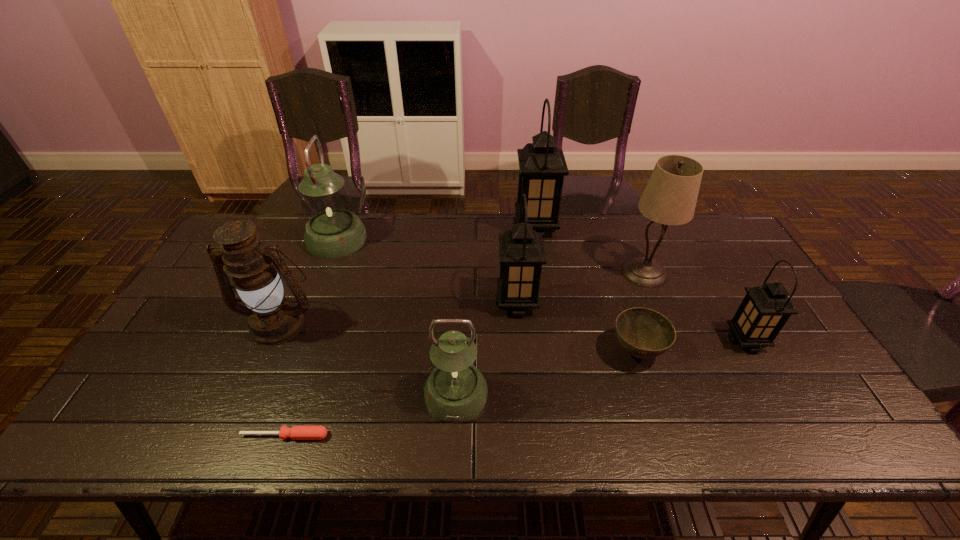
The height and width of the screenshot is (540, 960). Identify the location of blank space located 0.180m on the front of the left greenish lantern. (314, 299).

Where is `vacant space situated on the right of the second farthest black lantern`? vacant space situated on the right of the second farthest black lantern is located at coordinates (587, 303).

You are a GUI agent. You are given a task and a screenshot of the screen. Output one action in this format:
    pyautogui.click(x=<x>, y=<y>)
    Task: Click on the vacant space situated 0.320m on the back of the oil lamp
    This screenshot has width=960, height=540.
    Given the screenshot: What is the action you would take?
    pyautogui.click(x=317, y=235)

Find the location of a particular element. The image size is (960, 540). free space located 0.080m on the right of the nearest black lantern is located at coordinates (793, 341).

Identify the location of vacant space located on the right of the fourth lantern from right to left. (549, 394).

You are a GUI agent. You are given a task and a screenshot of the screen. Output one action in this format:
    pyautogui.click(x=<x>, y=<y>)
    Task: Click on the free point located on the back of the brown bowl
    This screenshot has height=540, width=960.
    Given the screenshot: What is the action you would take?
    pyautogui.click(x=618, y=295)

Locate an element on the screen. The width and height of the screenshot is (960, 540). vacant area located on the left of the nearest object is located at coordinates (117, 436).

You are a GUI agent. You are given a task and a screenshot of the screen. Output one action in this format:
    pyautogui.click(x=<x>, y=<y>)
    Task: Click on the lantern present at the near edge
    This screenshot has width=960, height=540.
    Given the screenshot: What is the action you would take?
    [456, 391]

Find the location of a particular element. screwdriver positioned at the near edge is located at coordinates (296, 432).

Where is `object that is at the right edge`? object that is at the right edge is located at coordinates (765, 309).